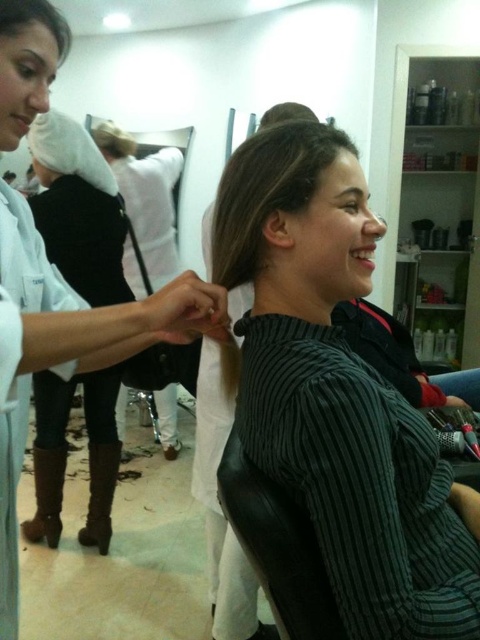
From the picture: Does black corduroy shirt at center appear on the right side of white fabric at upper left?

Correct, you'll find black corduroy shirt at center to the right of white fabric at upper left.

Which is more to the left, black corduroy shirt at center or white fabric at upper left?

white fabric at upper left

Identify the location of black corduroy shirt at center. The image size is (480, 640). (337, 392).

Identify the location of black corduroy shirt at center. The height and width of the screenshot is (640, 480). (337, 392).

Is black corduroy shirt at center to the right of brown matte hair at center from the viewer's perspective?

Correct, you'll find black corduroy shirt at center to the right of brown matte hair at center.

Can you confirm if black corduroy shirt at center is bigger than brown matte hair at center?

Indeed, black corduroy shirt at center has a larger size compared to brown matte hair at center.

Is point (310, 156) positioned in front of point (271, 182)?

Yes, point (310, 156) is closer to viewer.

Find the location of a particular element. The height and width of the screenshot is (640, 480). black corduroy shirt at center is located at coordinates [x=337, y=392].

Is dark brown hair at upper left shorter than brown matte hair at upper center?

Yes.

Who is higher up, dark brown hair at upper left or brown matte hair at upper center?

Positioned higher is brown matte hair at upper center.

Find the location of a particular element. dark brown hair at upper left is located at coordinates (35, 20).